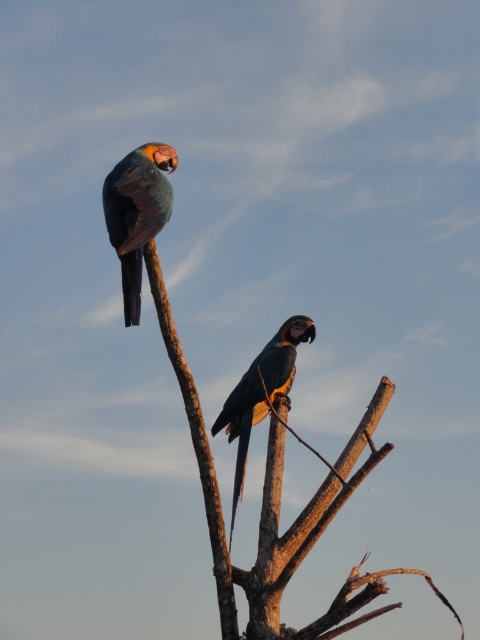
Question: Is shiny blue-green parrot at upper left bigger than shiny blue parrot at center?

Choices:
 (A) yes
 (B) no

Answer: (B)

Question: Which object is the farthest from the shiny blue parrot at center?

Choices:
 (A) shiny blue-green parrot at upper left
 (B) brown rough tree trunk at center

Answer: (A)

Question: Where is brown rough tree trunk at center located in relation to shiny blue parrot at center in the image?

Choices:
 (A) left
 (B) right

Answer: (B)

Question: Which object is positioned closest to the shiny blue parrot at center?

Choices:
 (A) brown rough tree trunk at center
 (B) shiny blue-green parrot at upper left

Answer: (A)

Question: Which point is closer to the camera taking this photo?

Choices:
 (A) (137, 236)
 (B) (323, 490)

Answer: (A)

Question: Does brown rough tree trunk at center appear on the left side of shiny blue parrot at center?

Choices:
 (A) no
 (B) yes

Answer: (A)